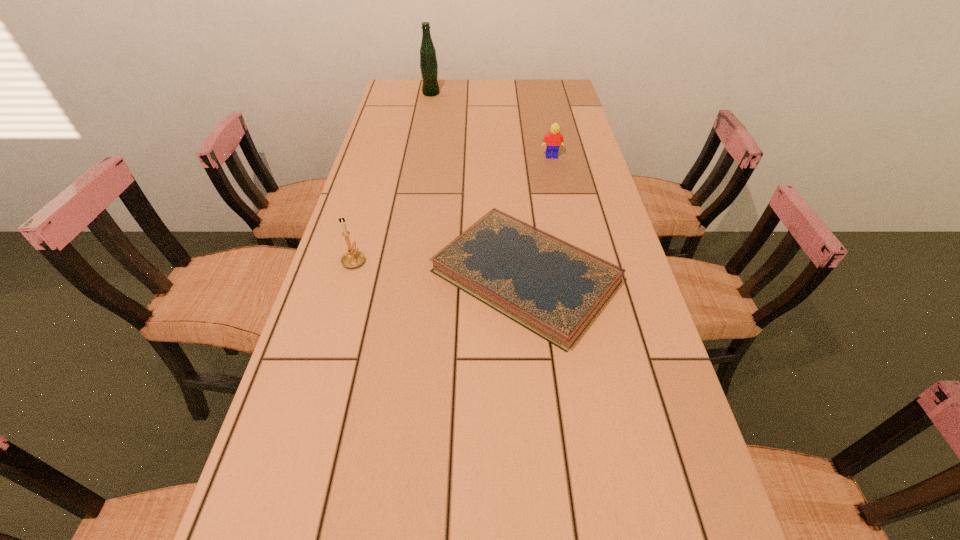
At what (x,y) coordinates should I click in order to perform the action: click on free space between the third object from right to left and the third tallest object. Please return your answer as a coordinate pair (x, y). Looking at the image, I should click on (492, 125).

This screenshot has height=540, width=960. I want to click on vacant area that lies between the beer bottle and the second farthest object, so click(x=492, y=125).

Choose which object is the third nearest neighbor to the candle holder. Please provide its 2D coordinates. Your answer should be formatted as a tuple, i.e. [(x, y)], where the tuple contains the x and y coordinates of a point satisfying the conditions above.

[(428, 60)]

Locate which object is the second closest to the beer bottle. Please provide its 2D coordinates. Your answer should be formatted as a tuple, i.e. [(x, y)], where the tuple contains the x and y coordinates of a point satisfying the conditions above.

[(554, 289)]

This screenshot has width=960, height=540. Identify the location of vacant space that satisfies the following two spatial constraints: 1. on the front side of the beer bottle; 2. on the right side of the paperback book. (398, 276).

In order to click on vacant point that satisfies the following two spatial constraints: 1. on the front side of the paperback book; 2. on the left side of the second object from left to right in this screenshot , I will do `click(398, 276)`.

Locate an element on the screen. This screenshot has width=960, height=540. free space that satisfies the following two spatial constraints: 1. on the handle side of the third object from right to left; 2. on the left side of the second tallest object is located at coordinates (402, 93).